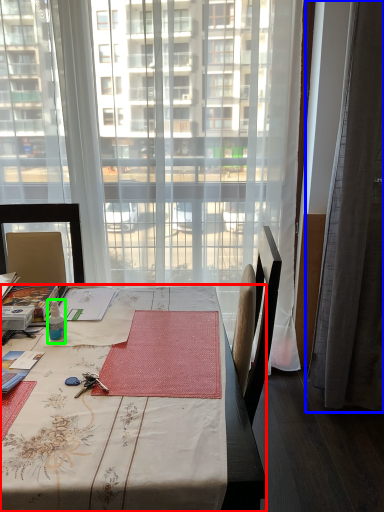
Question: Which object is the farthest from desk (highlighted by a red box)? Choose among these: curtain (highlighted by a blue box) or bottle (highlighted by a green box).

Choices:
 (A) curtain
 (B) bottle

Answer: (A)